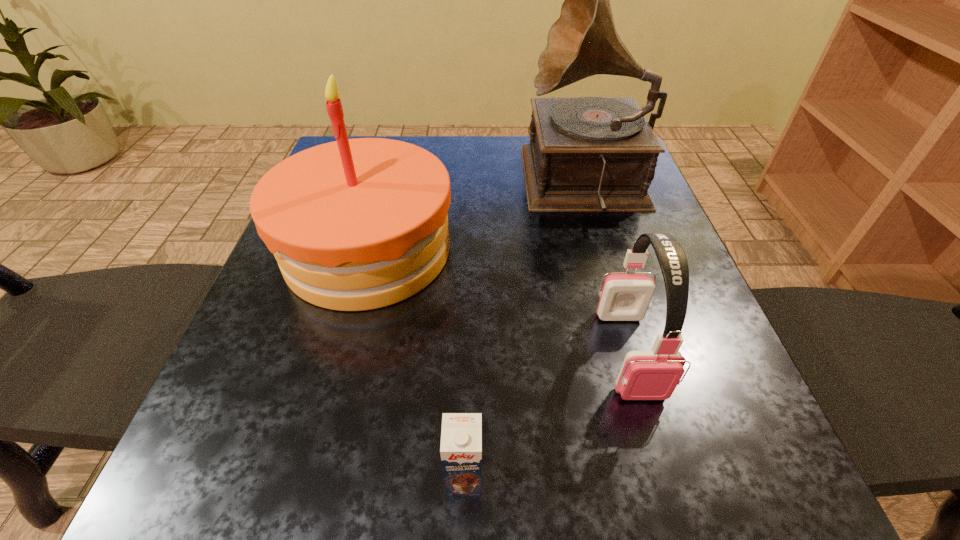
Find the location of a particular element. This screenshot has width=960, height=540. record player is located at coordinates (588, 154).

This screenshot has height=540, width=960. Identify the location of the third shortest object. (358, 224).

What are the coordinates of `birthday cake` in the screenshot? It's located at (358, 224).

Find the location of a particular element. The image size is (960, 540). earphone is located at coordinates (653, 374).

At what (x,y) coordinates should I click in order to perform the action: click on the nearest object. Please return your answer as a coordinate pair (x, y). The width and height of the screenshot is (960, 540). Looking at the image, I should click on (461, 436).

You are a GUI agent. You are given a task and a screenshot of the screen. Output one action in this format:
    pyautogui.click(x=<x>, y=<y>)
    Task: Click on the shortest object
    Image resolution: width=960 pixels, height=540 pixels.
    Given the screenshot: What is the action you would take?
    pyautogui.click(x=461, y=436)

Find the location of a particular element. The width and height of the screenshot is (960, 540). vacant space situated from the horn of the record player is located at coordinates (421, 184).

Locate an element on the screen. vacant space positioned from the horn of the record player is located at coordinates (447, 184).

Where is `blank area located 0.130m from the horn of the record player`? Image resolution: width=960 pixels, height=540 pixels. blank area located 0.130m from the horn of the record player is located at coordinates (468, 184).

Identify the location of blank area located 0.120m on the front of the second tallest object. This screenshot has width=960, height=540. pyautogui.click(x=333, y=378).